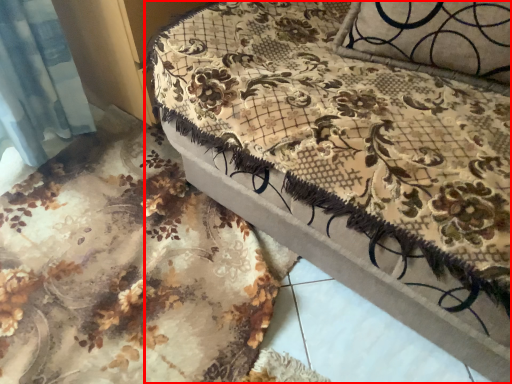
Question: From the image's perspective, where is furniture (annotated by the red box) located relative to bed frame?

Choices:
 (A) below
 (B) above

Answer: (B)